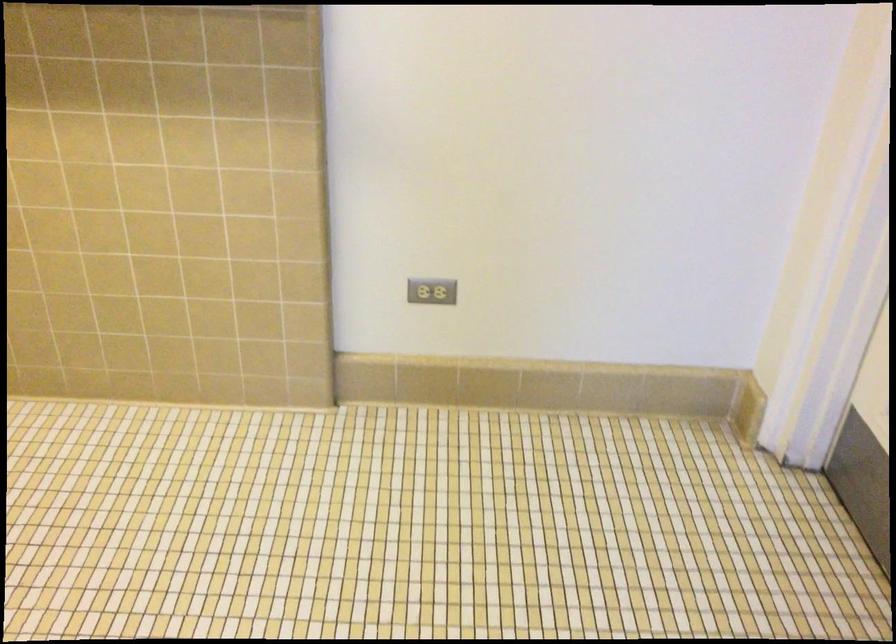
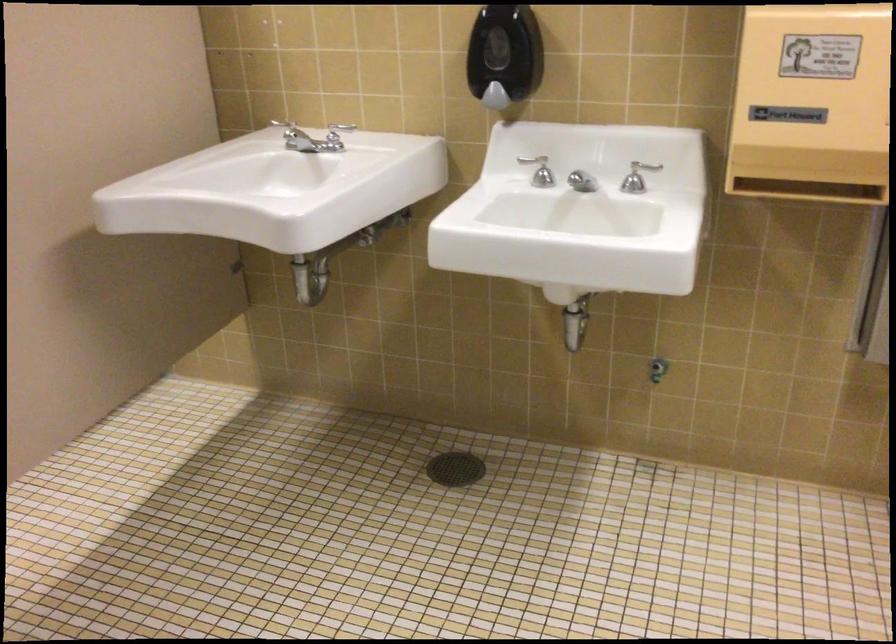
Based on the continuous images, in which direction is the camera rotating?

The rotation direction of the camera is left-down.